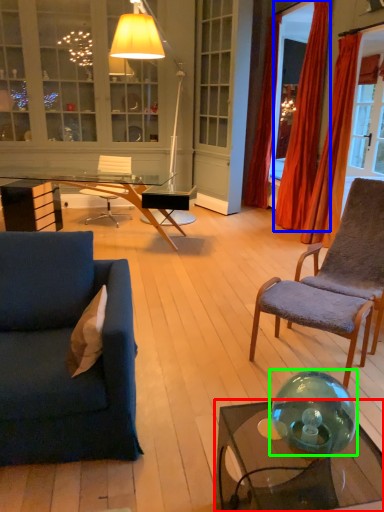
Question: Which object is the closest to the coffee table (highlighted by a red box)? Choose among these: curtain (highlighted by a blue box) or glass bowl (highlighted by a green box).

Choices:
 (A) curtain
 (B) glass bowl

Answer: (B)